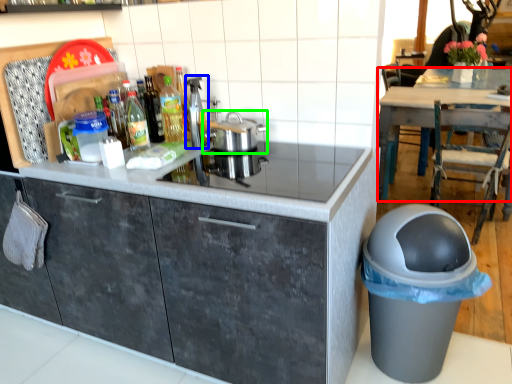
Question: Which is farther away from table (highlighted by a red box)? appliance (highlighted by a blue box) or kitchen appliance (highlighted by a green box)?

Choices:
 (A) appliance
 (B) kitchen appliance

Answer: (A)